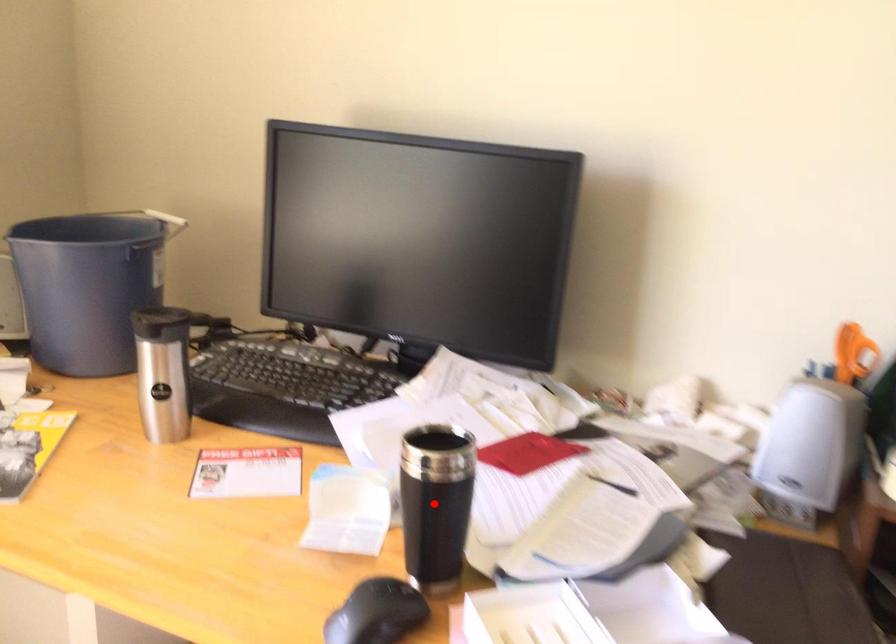
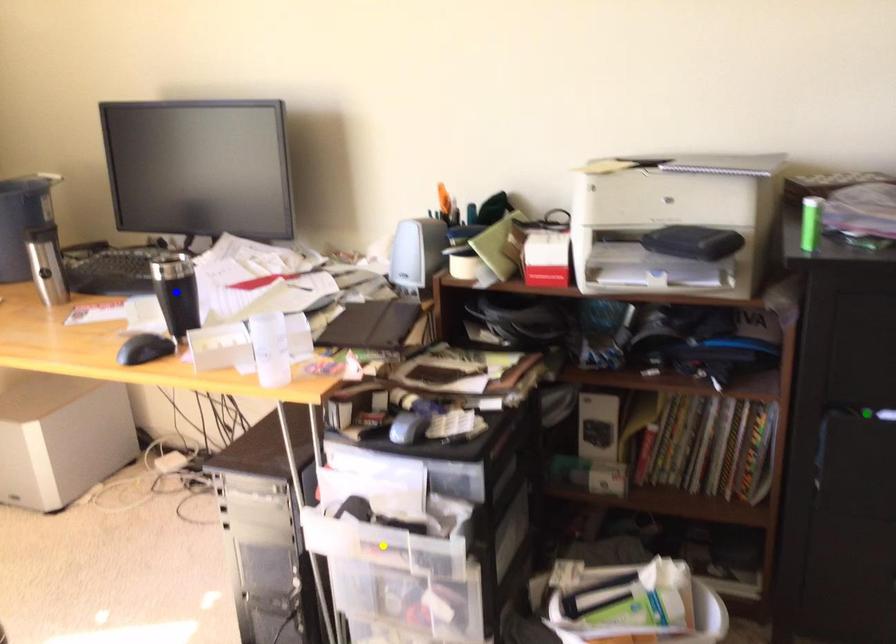
Question: I am providing you with two images of the same scene from different viewpoints. A red point is marked on the first image. You are given multiple points on the second image. Which point in image 2 represents the same 3d spot as the red point in image 1?

Choices:
 (A) green point
 (B) yellow point
 (C) blue point

Answer: (C)